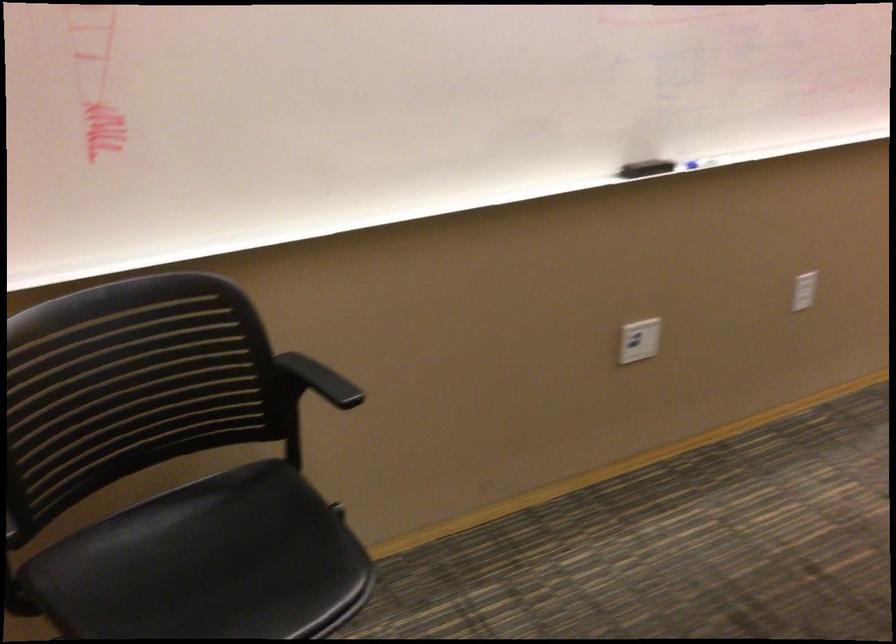
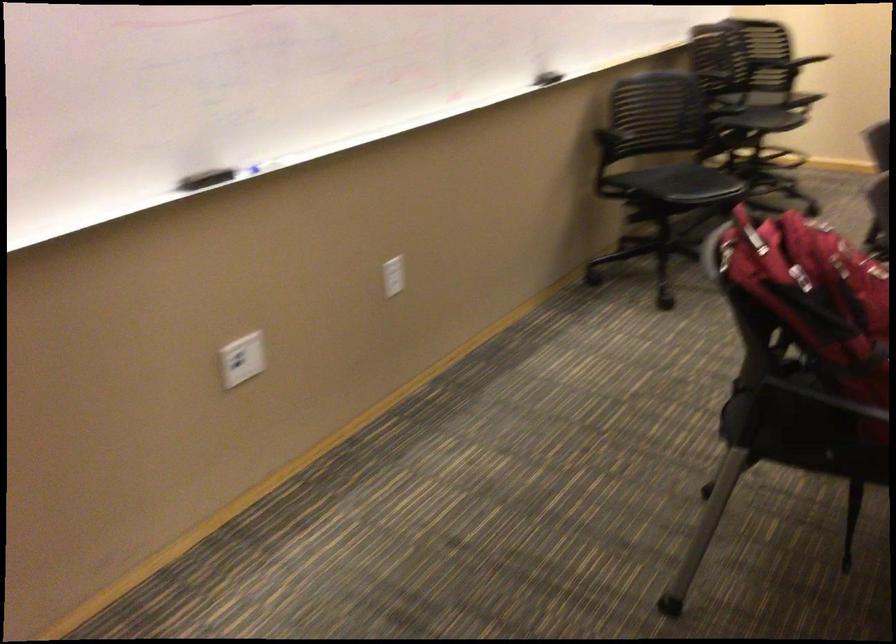
The point at (800, 289) is marked in the first image. Where is the corresponding point in the second image?

(392, 276)